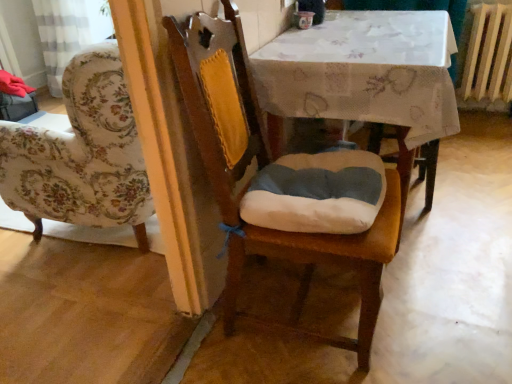
Image resolution: width=512 pixels, height=384 pixels. In order to click on free location to the right of wooden chair at center in this screenshot , I will do `click(443, 309)`.